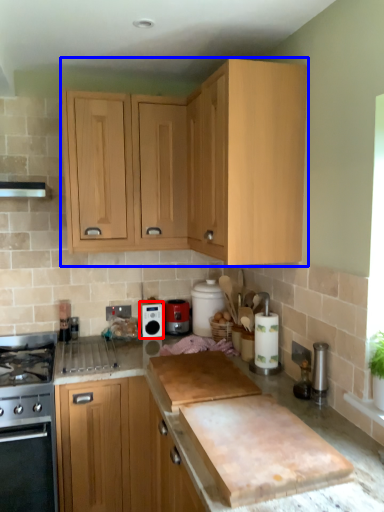
Question: Which point is closer to the camera, kitchen appliance (highlighted by a red box) or cabinetry (highlighted by a blue box)?

Choices:
 (A) kitchen appliance
 (B) cabinetry

Answer: (B)